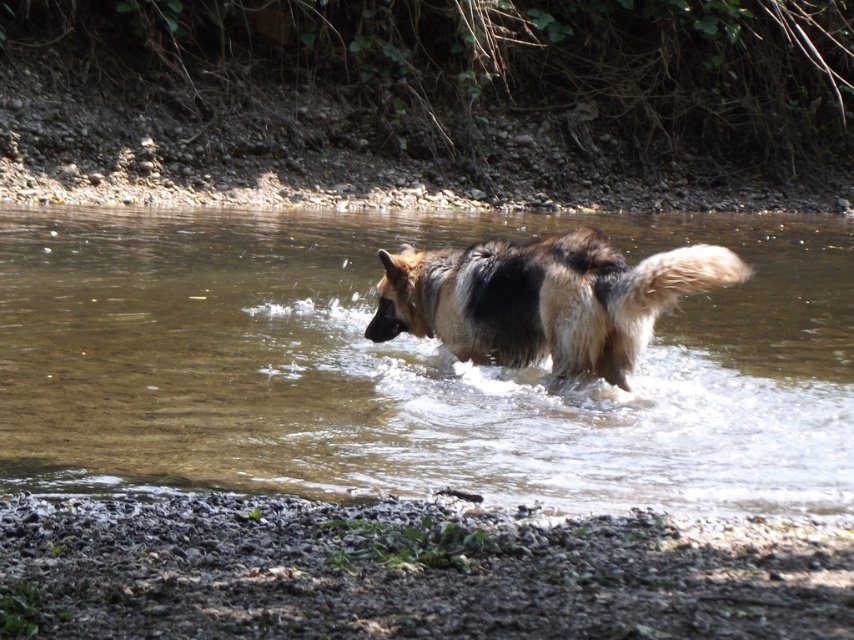
Based on the scene description, can you determine which object is taller between the clear water at center and the brown fur dog at center?

The clear water at center is much taller than the brown fur dog at center.

Based on the scene, can you determine which object occupies a larger area in the image between the clear water at center and the brown fur dog at center?

The clear water at center is larger in size than the brown fur dog at center, so the clear water at center occupies a larger area in the image.

You are a photographer trying to capture the brown fur dog at center in the clear water at center. From your current position, can you see the dog through the water?

The clear water at center is in front of brown fur dog at center, so yes, you can see the dog through the water since the water is clear and positioned in front of it.